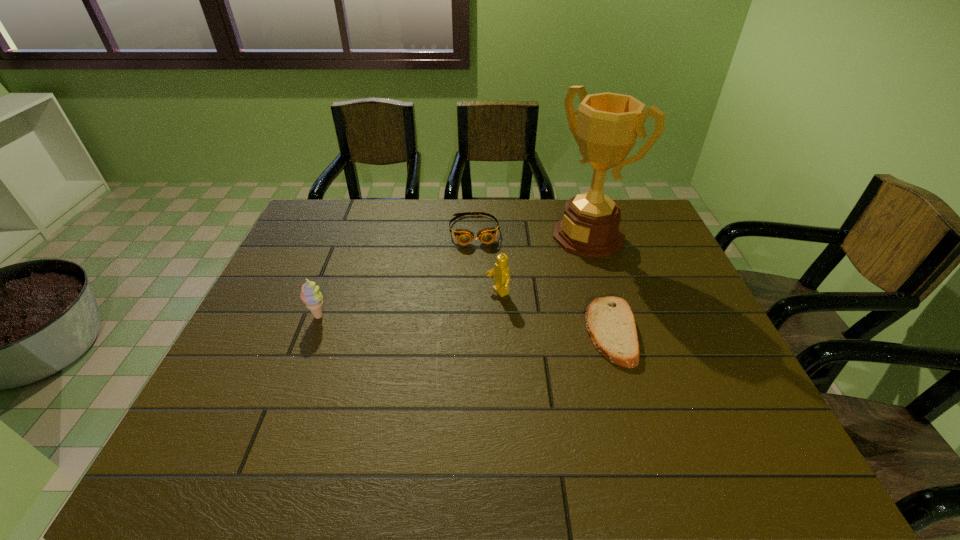
Locate an element on the screen. The width and height of the screenshot is (960, 540). object present at the far right corner is located at coordinates tap(608, 124).

I want to click on free point at the far edge, so click(417, 239).

Locate an element on the screen. blank space at the near edge is located at coordinates (638, 397).

I want to click on vacant area at the left edge, so click(289, 296).

Image resolution: width=960 pixels, height=540 pixels. I want to click on free region at the right edge of the desktop, so click(x=648, y=273).

The width and height of the screenshot is (960, 540). Find the location of `blank space at the far left corner of the desktop`. blank space at the far left corner of the desktop is located at coordinates (326, 206).

The image size is (960, 540). Find the location of `free space between the goggles and the Lego`. free space between the goggles and the Lego is located at coordinates (486, 262).

Identify the location of vacant region between the award and the sherbert. (453, 276).

You are a GUI agent. You are given a task and a screenshot of the screen. Output one action in this format:
    pyautogui.click(x=<x>, y=<y>)
    Task: Click on the free space between the shortest object and the goggles
    
    Given the screenshot: What is the action you would take?
    pyautogui.click(x=542, y=281)

Identify the location of vacant space in between the goggles and the tallest object. The height and width of the screenshot is (540, 960). (531, 233).